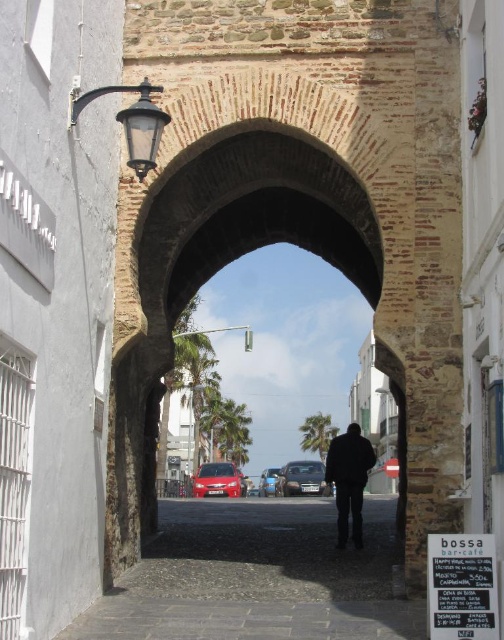
Does metallic silver car at center appear over metallic blue sedan at center?

Indeed, metallic silver car at center is positioned over metallic blue sedan at center.

Is metallic silver car at center below metallic blue sedan at center?

No.

Is point (312, 492) positioned behind point (271, 467)?

No, (312, 492) is in front of (271, 467).

I want to click on metallic silver car at center, so (301, 477).

Can you confirm if dark matte jacket at center is thinner than metallic silver car at center?

Indeed, dark matte jacket at center has a lesser width compared to metallic silver car at center.

Where is `dark matte jacket at center`? dark matte jacket at center is located at coordinates (348, 481).

The height and width of the screenshot is (640, 504). In order to click on dark matte jacket at center in this screenshot , I will do `click(348, 481)`.

I want to click on dark matte jacket at center, so tap(348, 481).

Measure the distance between dark gray cobblestone alley at center and camera.

108.70 feet

From the picture: Who is more forward, (334, 538) or (336, 492)?

Point (334, 538) is more forward.

At what (x,y) coordinates should I click in order to perform the action: click on dark gray cobblestone alley at center. Please return your answer as a coordinate pair (x, y). Image resolution: width=504 pixels, height=640 pixels. Looking at the image, I should click on (257, 577).